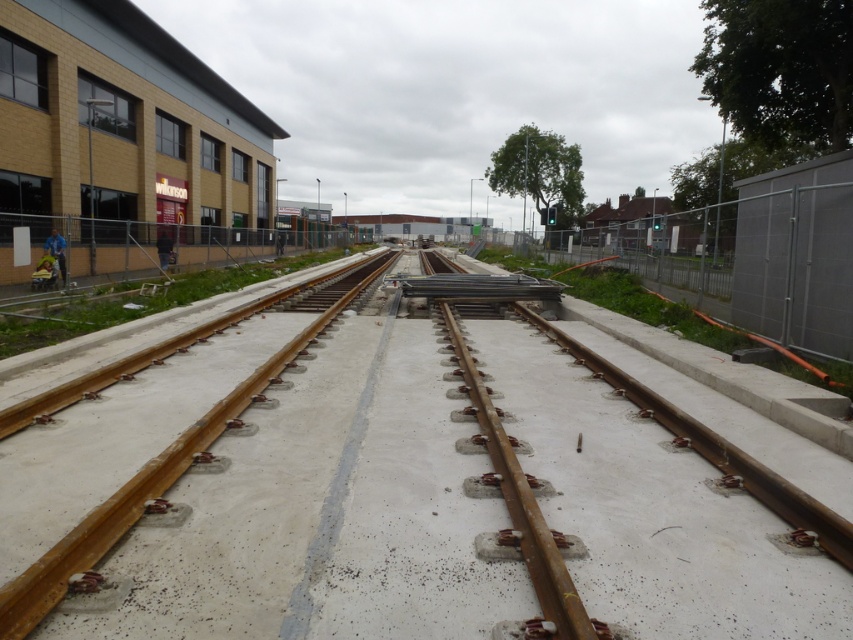
You are a construction worker standing at the edge of the construction site. You need to place a new concrete slab between the two rusty metal train tracks. Which track should you place the slab closer to, the rusty metal train track at center or the rusty metal train track at left?

You should place the slab closer to the rusty metal train track at center because it is located below the rusty metal train track at left, meaning it is further away from the edge where you are standing.

You are a construction worker standing at the edge of the construction site. You need to place a new concrete barrier between the two rusty metal train tracks. According to the scene, which track should you place the barrier closer to, the rusty metal train track at center or the rusty metal train track at left?

The rusty metal train track at center is to the right of the rusty metal train track at left. Therefore, to place the barrier between them, it should be positioned closer to the rusty metal train track at left.

Based on the photo, you are a construction worker who needs to place a 3.5 meter long wooden plank between the two rusty metal train track at center. Will the plank fit between them?

The distance between the two rusty metal train track at center is 2.53 meters, so the 3.5 meter long wooden plank will not fit between them as it is longer than the gap.